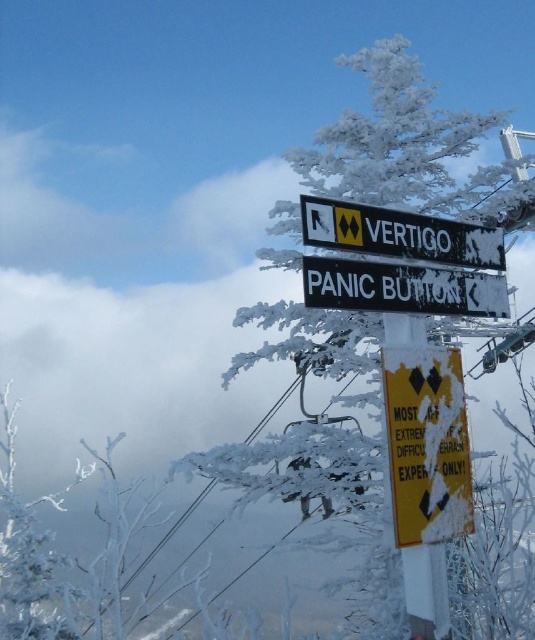
You are a ski instructor preparing to brief your students about the signs on the slope. You need to point out the size difference between the yellow reflective sign at center and the black plastic sign at center. Which one is smaller?

The yellow reflective sign at center is smaller compared to the black plastic sign at center.